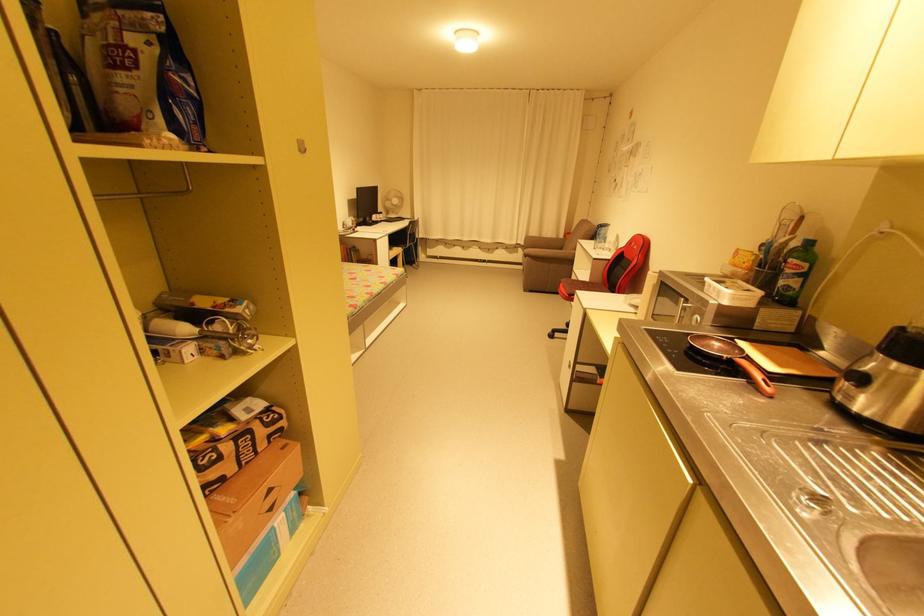
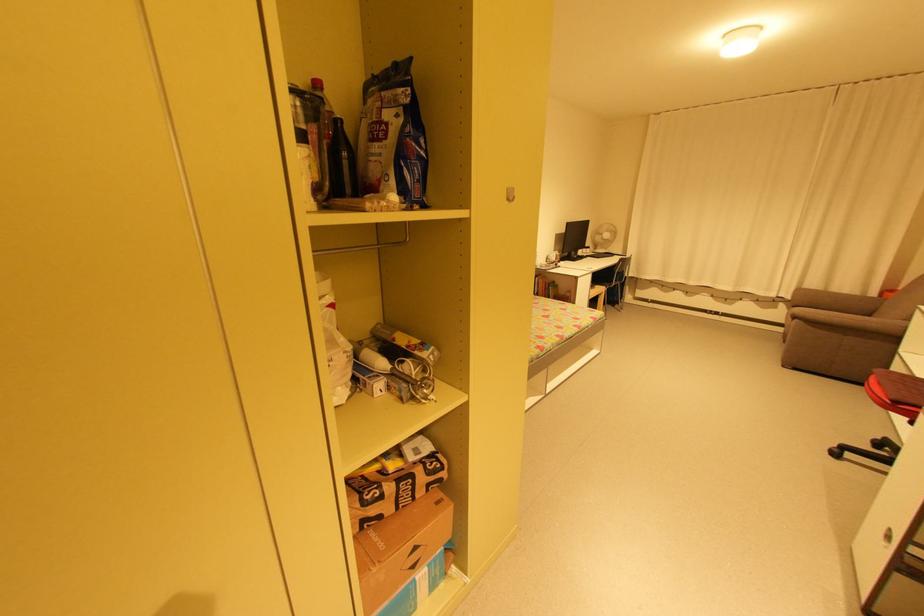
In the second image, find the point that corresponds to point (529, 291) in the first image.

(788, 367)